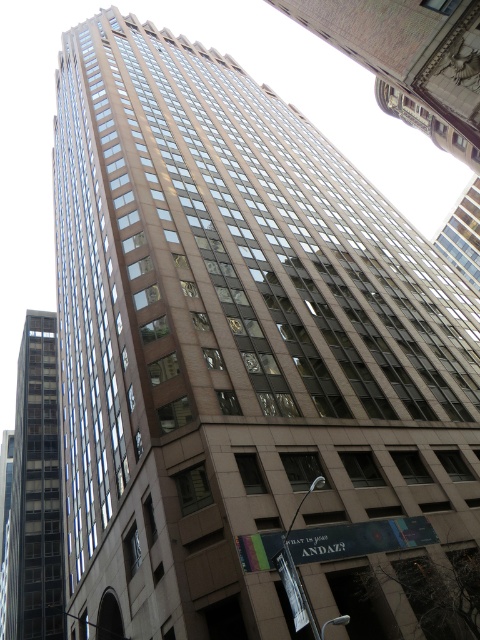
Which of these two, glassy reflective building at upper center or dark gray glass building at left, stands shorter?

With less height is glassy reflective building at upper center.

Who is positioned more to the left, glassy reflective building at upper center or dark gray glass building at left?

dark gray glass building at left is more to the left.

Measure the distance between point (428, 129) and camera.

Point (428, 129) and camera are 204.40 feet apart from each other.

You are a GUI agent. You are given a task and a screenshot of the screen. Output one action in this format:
    pyautogui.click(x=<x>, y=<y>)
    Task: Click on the glassy reflective building at upper center
    This screenshot has height=640, width=480.
    Given the screenshot: What is the action you would take?
    pyautogui.click(x=410, y=60)